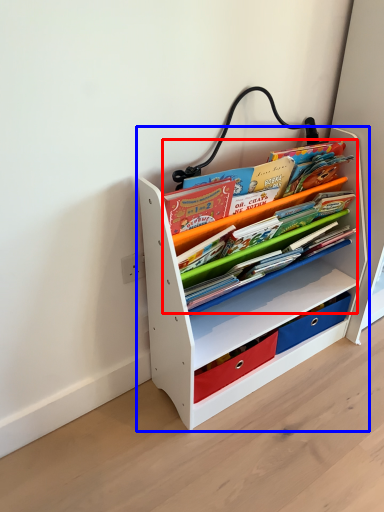
Question: Which object is closer to the camera taking this photo, book (highlighted by a red box) or shelf (highlighted by a blue box)?

Choices:
 (A) book
 (B) shelf

Answer: (B)